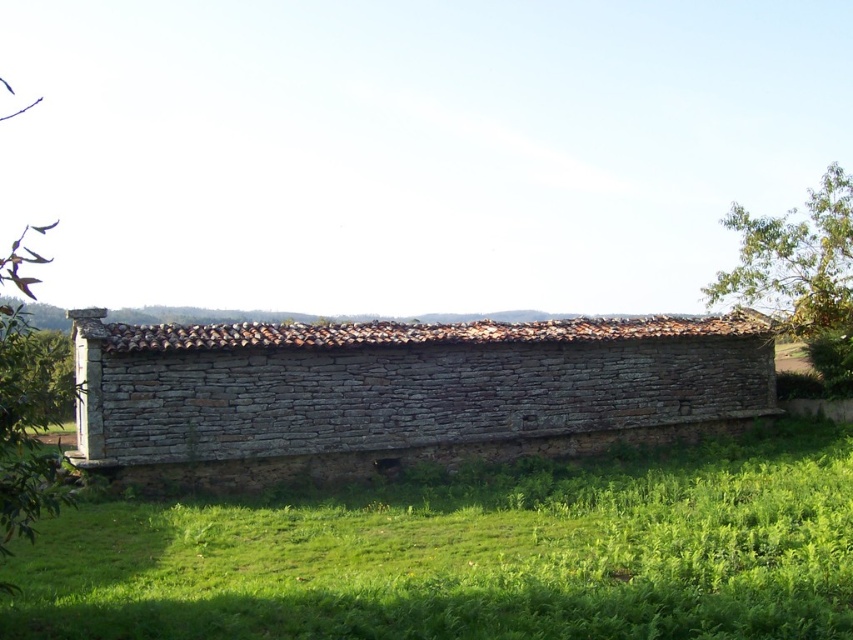
Can you confirm if green grass at lower center is positioned above gray stone hut at center?

No.

Is green grass at lower center to the left of gray stone hut at center from the viewer's perspective?

Incorrect, green grass at lower center is not on the left side of gray stone hut at center.

Who is more distant from viewer, (45, 588) or (456, 330)?

Point (456, 330)

Where is `green grass at lower center`? The width and height of the screenshot is (853, 640). green grass at lower center is located at coordinates (473, 554).

Does point (33, 545) come behind point (791, 305)?

No, it is in front of (791, 305).

Where is `green grass at lower center`? The height and width of the screenshot is (640, 853). green grass at lower center is located at coordinates (473, 554).

Image resolution: width=853 pixels, height=640 pixels. Identify the location of gray stone hut at center. (399, 392).

Who is more distant from viewer, (419,442) or (814,292)?

The point (814,292) is behind.

Which is behind, point (576, 378) or point (811, 289)?

The point (811, 289) is behind.

What are the coordinates of `gray stone hut at center` in the screenshot? It's located at (399, 392).